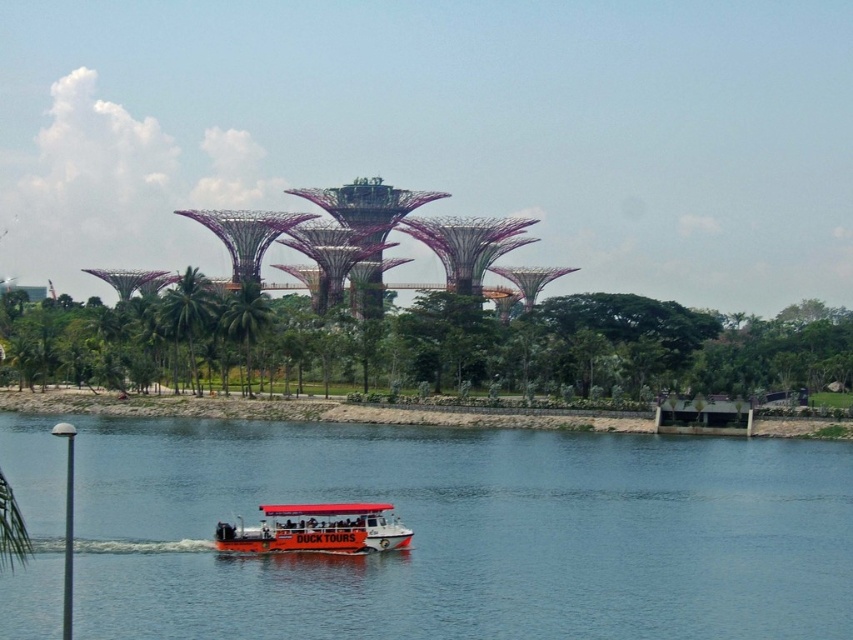
Question: Is blue water at center below orange matte boat at lower center?

Choices:
 (A) no
 (B) yes

Answer: (A)

Question: Is green leafy trees at center below orange matte boat at lower center?

Choices:
 (A) no
 (B) yes

Answer: (A)

Question: Which object appears farthest from the camera in this image?

Choices:
 (A) blue water at center
 (B) orange matte boat at lower center

Answer: (B)

Question: Which object is positioned closest to the green leafy trees at center?

Choices:
 (A) orange matte boat at lower center
 (B) green leafy tree at center

Answer: (B)

Question: Is green leafy trees at center to the right of green leafy tree at center from the viewer's perspective?

Choices:
 (A) no
 (B) yes

Answer: (B)

Question: Which point appears closest to the camera in this image?

Choices:
 (A) (26, 384)
 (B) (238, 536)
 (C) (248, 305)

Answer: (B)